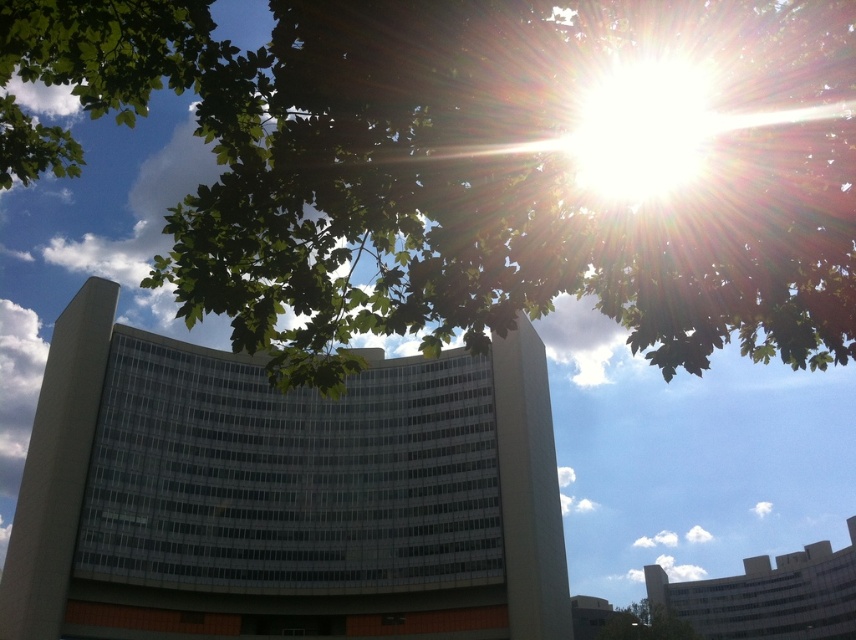
Is green leafy tree at upper center taller than green leafy tree at lower right?

No, green leafy tree at upper center is not taller than green leafy tree at lower right.

Is green leafy tree at upper center positioned before green leafy tree at lower right?

Yes.

Locate an element on the screen. This screenshot has width=856, height=640. green leafy tree at upper center is located at coordinates (468, 172).